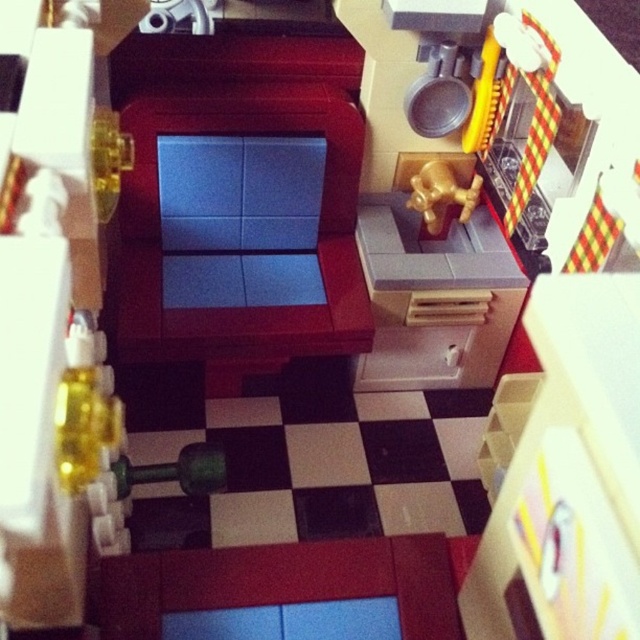
Does white plastic drawer at center appear under gold metallic faucet at upper right?

Indeed, white plastic drawer at center is positioned under gold metallic faucet at upper right.

Does white plastic drawer at center appear over gold metallic faucet at upper right?

No.

Does point (493, 346) come in front of point (461, 195)?

That is False.

Locate an element on the screen. The image size is (640, 640). white plastic drawer at center is located at coordinates (442, 342).